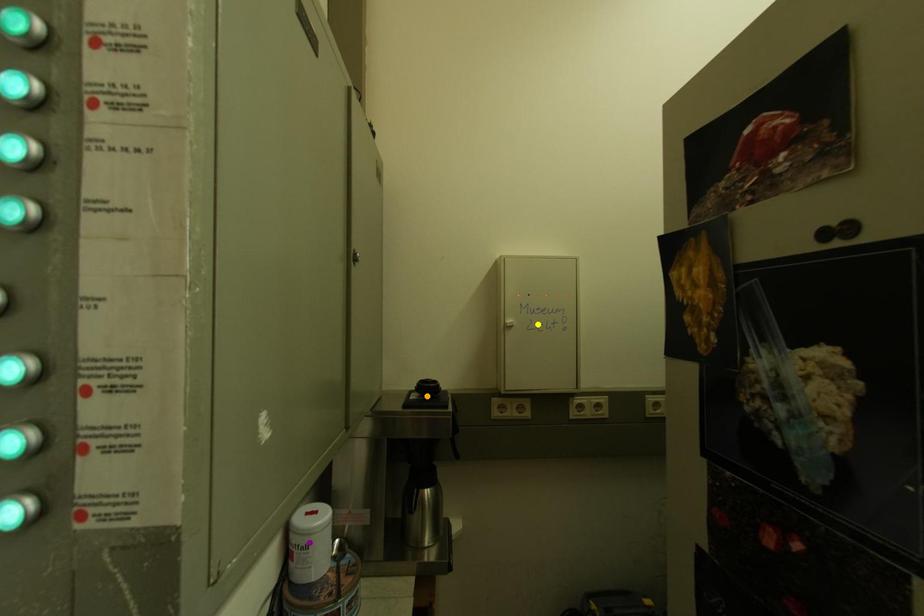
Order these from nearest to farthest:
yellow point
purple point
orange point

purple point, orange point, yellow point